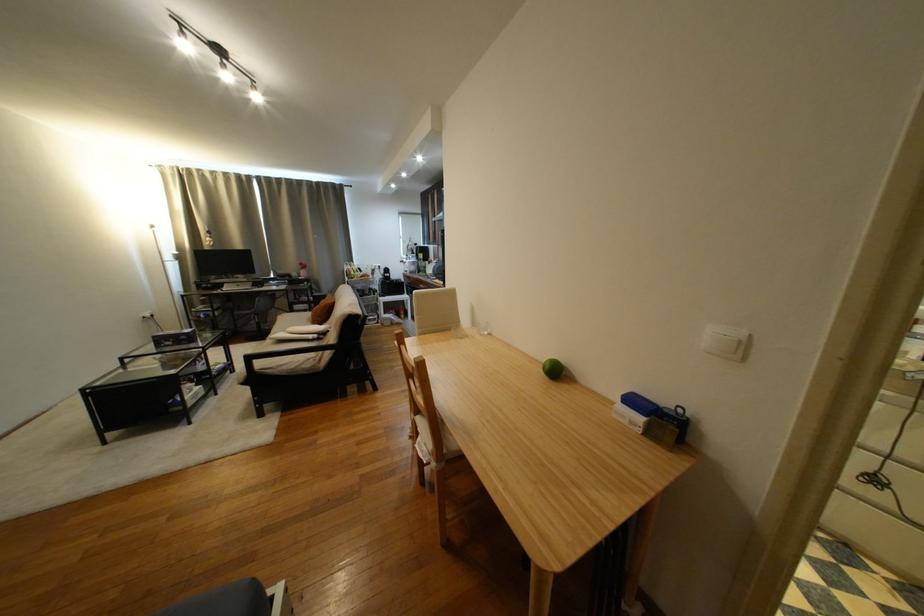
Where would you resting arm the black sofa armrest? Please return your answer as a coordinate pair (x, y).

(235, 601)